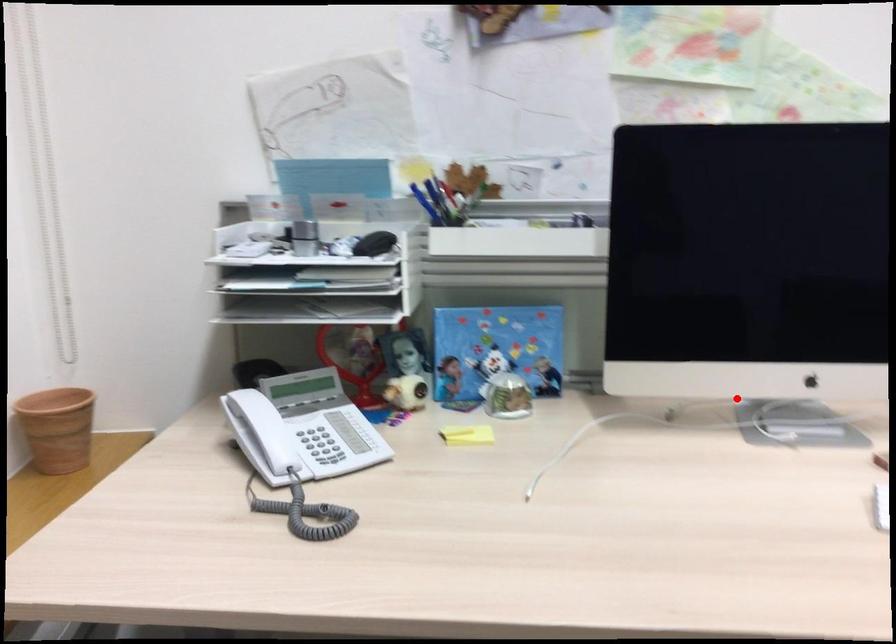
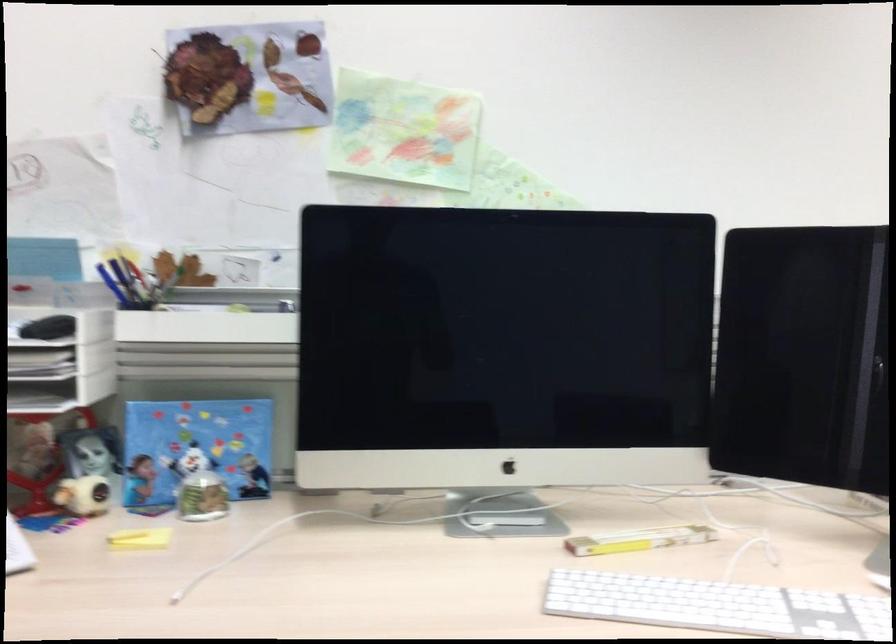
Question: I am providing you with two images of the same scene from different viewpoints. A red point is marked on the first image. At the location where the point appears in image 1, is it still visible in image 2?

Choices:
 (A) Yes
 (B) No

Answer: (A)